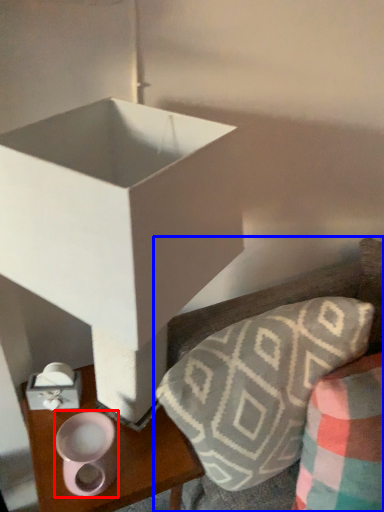
Question: Which object is further to the camera taking this photo, candle holder (highlighted by a red box) or furniture (highlighted by a blue box)?

Choices:
 (A) candle holder
 (B) furniture

Answer: (A)